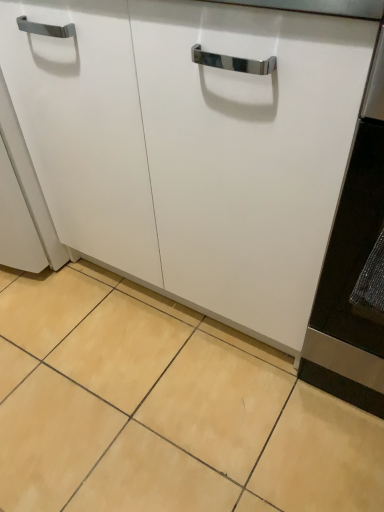
The width and height of the screenshot is (384, 512). Find the location of `vacant region above beige ceramic tile at lower center (from a real-world perspective)`. vacant region above beige ceramic tile at lower center (from a real-world perspective) is located at coordinates (130, 379).